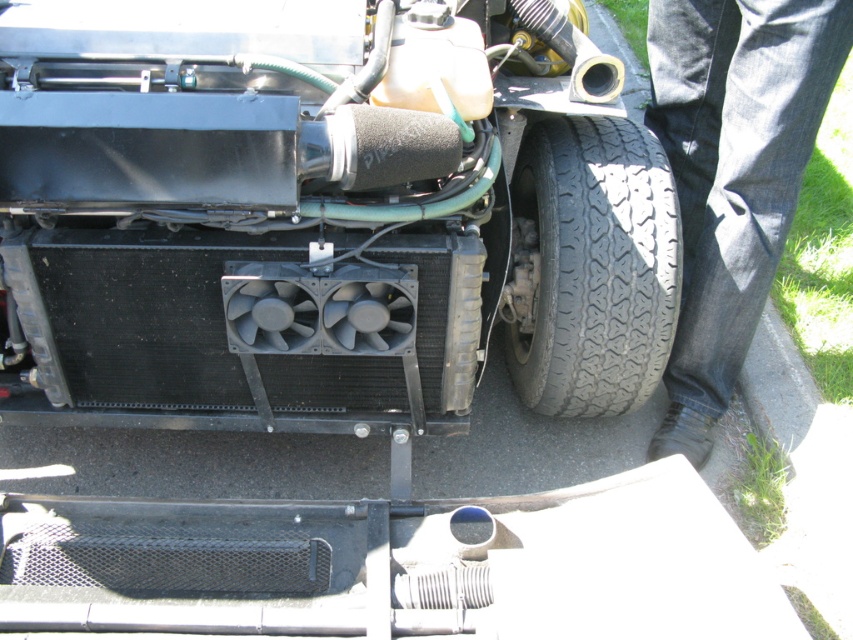
You are a mechanic working on a vehicle and notice two items in the engine bay. You see the dark blue jeans at lower right and the black rubber tire at lower right. Which item is positioned more to the right side of the engine bay?

The dark blue jeans at lower right are positioned more to the right side of the engine bay than the black rubber tire at lower right.

You are a mechanic working on a vehicle and need to access the radiator in the engine bay. You notice two items at the lower right corner of your workspace. Which item is narrower between the dark blue jeans at lower right and the black rubber tire at lower right?

The dark blue jeans at lower right is narrower compared to the black rubber tire at lower right.